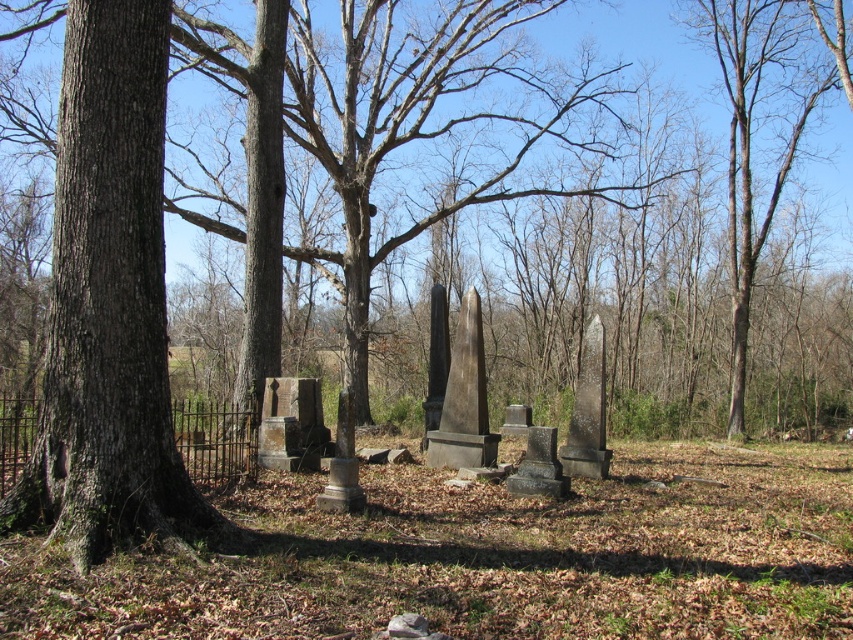
Question: Can you confirm if brown rough bark tree at left is wider than brown bark tree at right?

Choices:
 (A) yes
 (B) no

Answer: (B)

Question: Which point is farther to the camera?

Choices:
 (A) brown rough bark tree at left
 (B) brown bark tree at right

Answer: (B)

Question: Which of the following is the closest to the observer?

Choices:
 (A) brown bark tree at right
 (B) brown rough bark tree at left

Answer: (B)

Question: Is brown rough bark tree at left above brown bark tree at right?

Choices:
 (A) no
 (B) yes

Answer: (A)

Question: Can you confirm if brown rough bark tree at left is positioned to the right of brown bark tree at right?

Choices:
 (A) yes
 (B) no

Answer: (B)